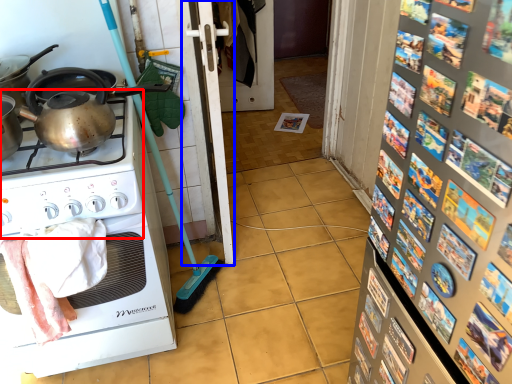
Question: Which point is further to the camera, gas stove (highlighted by a red box) or screen door (highlighted by a blue box)?

Choices:
 (A) gas stove
 (B) screen door

Answer: (B)